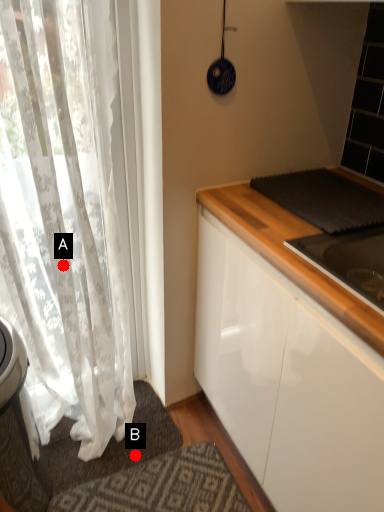
Question: Two points are circled on the image, labeled by A and B beside each circle. Among these points, which one is farthest from the camera?

Choices:
 (A) A is further
 (B) B is further

Answer: (B)